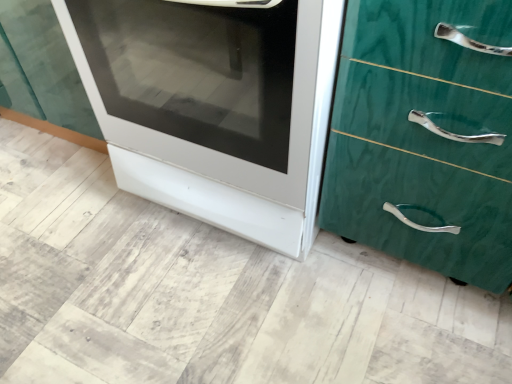
What do you see at coordinates (214, 105) in the screenshot? This screenshot has height=384, width=512. I see `white glossy oven at center` at bounding box center [214, 105].

You are a GUI agent. You are given a task and a screenshot of the screen. Output one action in this format:
    pyautogui.click(x=<x>, y=<y>)
    Task: Click on the white glossy oven at center
    This screenshot has height=384, width=512.
    Given the screenshot: What is the action you would take?
    pyautogui.click(x=214, y=105)

The image size is (512, 384). Describe the element at coordinates (424, 137) in the screenshot. I see `green marble chest of drawers at right` at that location.

The image size is (512, 384). Find the location of `green marble chest of drawers at right`. green marble chest of drawers at right is located at coordinates (424, 137).

Identify the location of white glossy oven at center. (214, 105).

Is white glossy oven at center to the left of green marble chest of drawers at right from the viewer's perspective?

Indeed, white glossy oven at center is positioned on the left side of green marble chest of drawers at right.

Is white glossy oven at center further to camera compared to green marble chest of drawers at right?

Yes, white glossy oven at center is further from the camera.

Does point (111, 119) come farther from viewer compared to point (502, 233)?

Yes, it is behind point (502, 233).

From the image's perspective, between white glossy oven at center and green marble chest of drawers at right, which one is located above?

white glossy oven at center.

From a real-world perspective, is white glossy oven at center positioned over green marble chest of drawers at right based on gravity?

Incorrect, from a real-world perspective, white glossy oven at center is lower than green marble chest of drawers at right.

Consider the image. Considering the relative sizes of white glossy oven at center and green marble chest of drawers at right in the image provided, is white glossy oven at center wider than green marble chest of drawers at right?

Yes.

Who is taller, white glossy oven at center or green marble chest of drawers at right?

With more height is white glossy oven at center.

Between white glossy oven at center and green marble chest of drawers at right, which one has larger size?

white glossy oven at center.

Which is correct: white glossy oven at center is inside green marble chest of drawers at right, or outside of it?

white glossy oven at center is not enclosed by green marble chest of drawers at right.

Are white glossy oven at center and green marble chest of drawers at right beside each other?

white glossy oven at center and green marble chest of drawers at right are not in contact.

Could you tell me if white glossy oven at center is turned towards green marble chest of drawers at right?

No, white glossy oven at center is not turned towards green marble chest of drawers at right.

Measure the distance from white glossy oven at center to green marble chest of drawers at right.

white glossy oven at center is 23.36 centimeters from green marble chest of drawers at right.

There is a white glossy oven at center. Where is `the chest of drawers above it (from a real-world perspective)`? This screenshot has width=512, height=384. the chest of drawers above it (from a real-world perspective) is located at coordinates (424, 137).

Considering the relative positions of green marble chest of drawers at right and white glossy oven at center in the image provided, is green marble chest of drawers at right to the left of white glossy oven at center from the viewer's perspective?

No, green marble chest of drawers at right is not to the left of white glossy oven at center.

In the image, is green marble chest of drawers at right positioned in front of or behind white glossy oven at center?

In the image, green marble chest of drawers at right appears in front of white glossy oven at center.

Is point (486, 66) closer to camera compared to point (243, 129)?

Yes, point (486, 66) is in front of point (243, 129).

From the image's perspective, is green marble chest of drawers at right positioned above or below white glossy oven at center?

Based on their image positions, green marble chest of drawers at right is located beneath white glossy oven at center.

From a real-world perspective, which object stands above the other?

green marble chest of drawers at right.

Between green marble chest of drawers at right and white glossy oven at center, which one has larger width?

Wider between the two is white glossy oven at center.

Can you confirm if green marble chest of drawers at right is shorter than white glossy oven at center?

Yes.

Which of these two, green marble chest of drawers at right or white glossy oven at center, is smaller?

green marble chest of drawers at right.

Is green marble chest of drawers at right completely or partially outside of white glossy oven at center?

green marble chest of drawers at right is positioned outside white glossy oven at center.

Looking at this image, is green marble chest of drawers at right touching white glossy oven at center?

green marble chest of drawers at right and white glossy oven at center are not in contact.

Is white glossy oven at center at the back of green marble chest of drawers at right?

That's not correct — green marble chest of drawers at right is not looking away from white glossy oven at center.

How many degrees apart are the facing directions of green marble chest of drawers at right and white glossy oven at center?

green marble chest of drawers at right and white glossy oven at center are facing 0.000303 degrees away from each other.

Locate an element on the screen. This screenshot has width=512, height=384. the chest of drawers that appears below the white glossy oven at center (from the image's perspective) is located at coordinates (424, 137).

Locate an element on the screen. oven behind the green marble chest of drawers at right is located at coordinates (214, 105).

I want to click on oven above the green marble chest of drawers at right (from the image's perspective), so click(x=214, y=105).